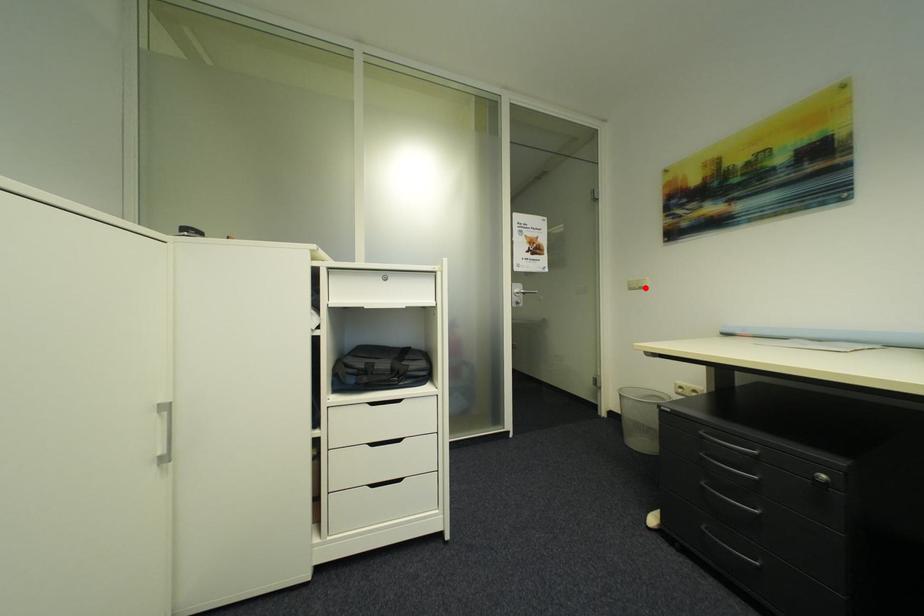
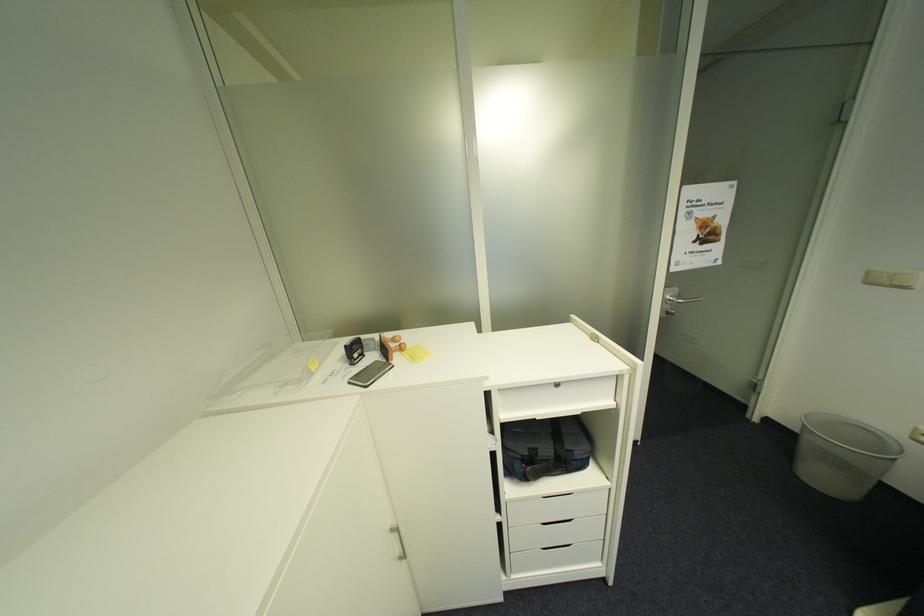
In the second image, find the point that corresponds to the highlighted location in the first image.

(895, 285)